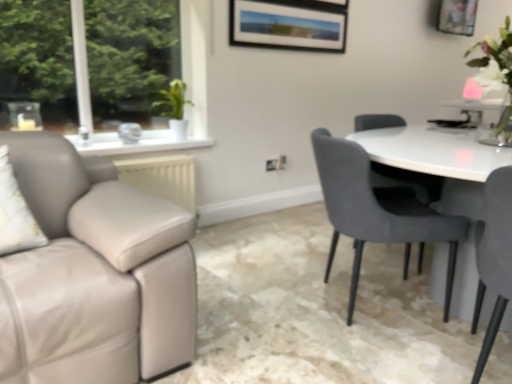
This screenshot has width=512, height=384. In order to click on vacant space underneath matte gray chair at right, which is the first chair from front to back (from a real-world perspective) in this screenshot , I will do `click(474, 360)`.